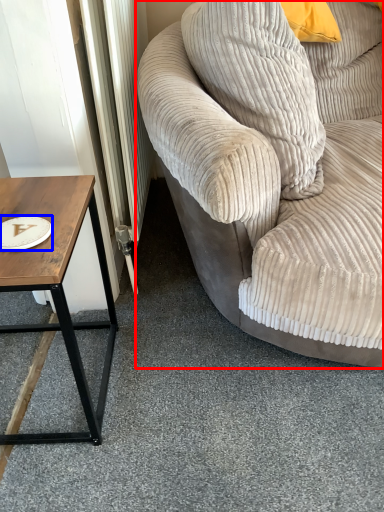
Question: Among these objects, which one is nearest to the camera, studio couch (highlighted by a red box) or paper plate (highlighted by a blue box)?

Choices:
 (A) studio couch
 (B) paper plate

Answer: (A)